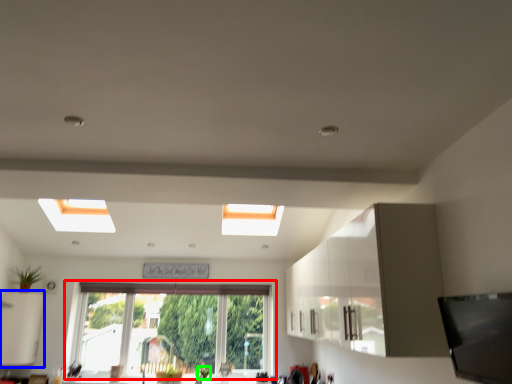
Question: Which object is positioned farthest from window (highlighted by a red box)? Select from cabinetry (highlighted by a blue box) and plant (highlighted by a green box).

Choices:
 (A) cabinetry
 (B) plant

Answer: (A)